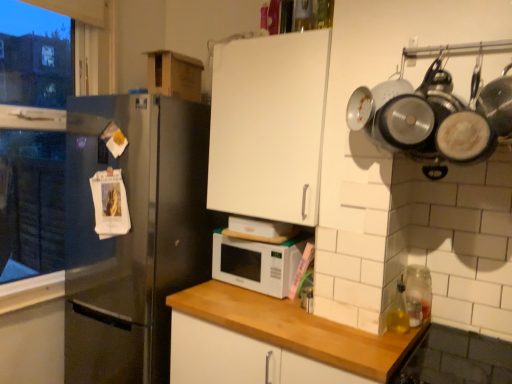
Question: Is white matte microwave at center wider than clear glass jar at right?

Choices:
 (A) no
 (B) yes

Answer: (B)

Question: Considering the relative positions of white matte microwave at center and clear glass jar at right in the image provided, is white matte microwave at center to the left of clear glass jar at right from the viewer's perspective?

Choices:
 (A) yes
 (B) no

Answer: (A)

Question: Is white matte microwave at center not close to clear glass jar at right?

Choices:
 (A) yes
 (B) no

Answer: (B)

Question: Does white matte microwave at center have a greater height compared to clear glass jar at right?

Choices:
 (A) yes
 (B) no

Answer: (A)

Question: Are white matte microwave at center and clear glass jar at right beside each other?

Choices:
 (A) yes
 (B) no

Answer: (B)

Question: Choose the correct answer: Is clear glass jar at right inside stainless steel refrigerator at left or outside it?

Choices:
 (A) inside
 (B) outside

Answer: (B)

Question: From the image's perspective, is clear glass jar at right positioned above or below stainless steel refrigerator at left?

Choices:
 (A) above
 (B) below

Answer: (B)

Question: From a real-world perspective, relative to stainless steel refrigerator at left, is clear glass jar at right vertically above or below?

Choices:
 (A) below
 (B) above

Answer: (B)

Question: Considering the positions of point (416, 324) and point (66, 266), is point (416, 324) closer or farther from the camera than point (66, 266)?

Choices:
 (A) closer
 (B) farther

Answer: (A)

Question: Relative to clear glass jar at right, is white wood countertop at center, which appears as the first cabinetry when ordered from the bottom, in front or behind?

Choices:
 (A) front
 (B) behind

Answer: (A)

Question: From the image's perspective, relative to clear glass jar at right, is white wood countertop at center, which appears as the first cabinetry when ordered from the bottom, above or below?

Choices:
 (A) above
 (B) below

Answer: (B)

Question: In terms of size, does white wood countertop at center, which appears as the first cabinetry when ordered from the bottom, appear bigger or smaller than clear glass jar at right?

Choices:
 (A) big
 (B) small

Answer: (A)

Question: From a real-world perspective, is white wood countertop at center, which appears as the first cabinetry when ordered from the bottom, positioned above or below clear glass jar at right?

Choices:
 (A) below
 (B) above

Answer: (A)

Question: From the image's perspective, relative to clear glass jar at right, is stainless steel refrigerator at left above or below?

Choices:
 (A) above
 (B) below

Answer: (A)

Question: Is stainless steel refrigerator at left bigger or smaller than clear glass jar at right?

Choices:
 (A) small
 (B) big

Answer: (B)